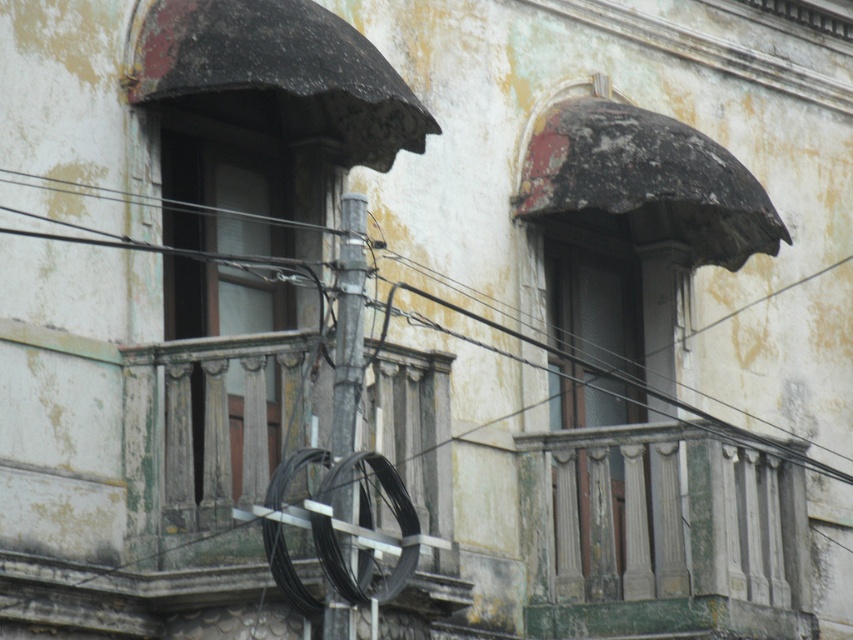
Consider the image. Which is more to the left, rusty metal awning at upper center or black wire at center?

rusty metal awning at upper center is more to the left.

Does rusty metal awning at upper center have a greater height compared to black wire at center?

Yes.

The width and height of the screenshot is (853, 640). In order to click on rusty metal awning at upper center in this screenshot , I will do `click(277, 76)`.

Can you confirm if black wire at center is smaller than metallic gray pole at center?

Answer: Actually, black wire at center might be larger than metallic gray pole at center.

Consider the image. Is black wire at center bigger than metallic gray pole at center?

Correct, black wire at center is larger in size than metallic gray pole at center.

Between point (280, 541) and point (335, 616), which one is positioned in front?

Point (335, 616) is more forward.

Find the location of a particular element. The image size is (853, 640). black wire at center is located at coordinates (334, 529).

Is green stone balcony at right to the right of black wire at center from the viewer's perspective?

Yes, green stone balcony at right is to the right of black wire at center.

Is green stone balcony at right bigger than black wire at center?

Indeed, green stone balcony at right has a larger size compared to black wire at center.

Is point (628, 628) farther from viewer compared to point (276, 564)?

Yes, it is.

You are a GUI agent. You are given a task and a screenshot of the screen. Output one action in this format:
    pyautogui.click(x=<x>, y=<y>)
    Task: Click on the green stone balcony at right
    This screenshot has height=640, width=853.
    Given the screenshot: What is the action you would take?
    pyautogui.click(x=660, y=534)